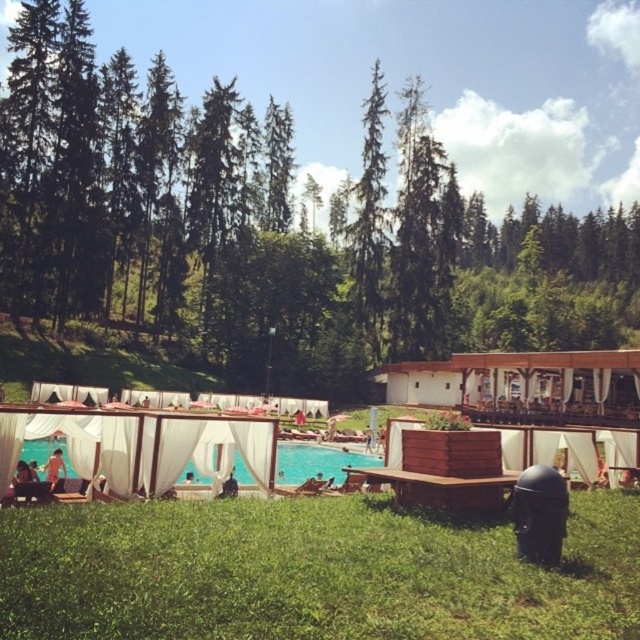
Can you confirm if green leafy tree at center is bigger than green textured tree at center?

Correct, green leafy tree at center is larger in size than green textured tree at center.

Which is in front, point (42, 220) or point (364, 189)?

Point (42, 220) is more forward.

Is point (93, 54) closer to viewer compared to point (369, 104)?

Yes, point (93, 54) is in front of point (369, 104).

Identify the location of green leafy tree at center. (264, 214).

Does green grass at lower center appear over blue glossy pool at center?

Indeed, green grass at lower center is positioned over blue glossy pool at center.

Who is shorter, green grass at lower center or blue glossy pool at center?

green grass at lower center

Is point (289, 502) positioned behind point (337, 451)?

No, (289, 502) is closer to viewer.

Locate an element on the screen. green grass at lower center is located at coordinates (310, 572).

The image size is (640, 640). In order to click on blue glossy pool at center in this screenshot , I will do `click(317, 461)`.

Who is taller, blue glossy pool at center or light brown wooden bench at lower left?

blue glossy pool at center is taller.

Does point (76, 474) come farther from viewer compared to point (61, 467)?

Yes, it is.

This screenshot has height=640, width=640. Find the location of `blue glossy pool at center`. blue glossy pool at center is located at coordinates (317, 461).